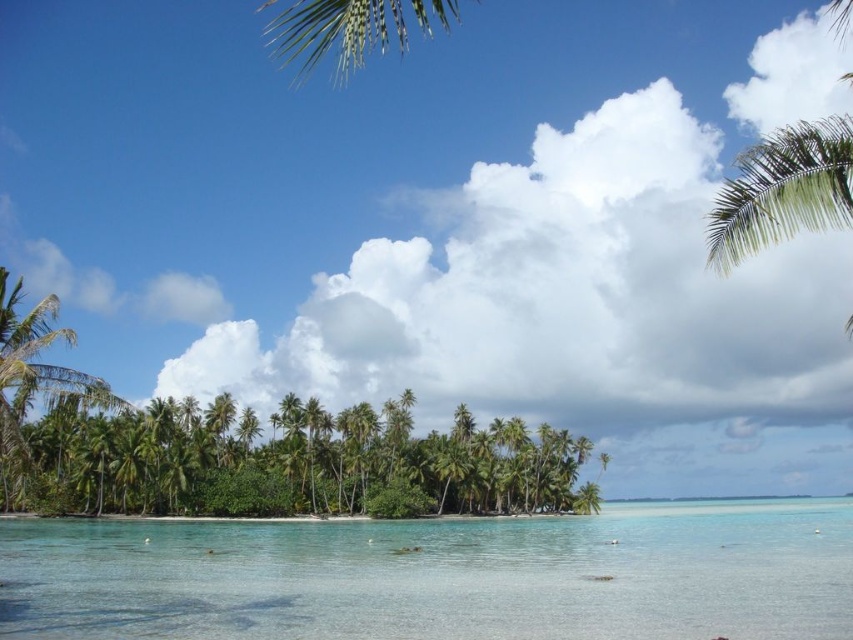
Between point (281, 584) and point (808, 132), which one is positioned in front?

Point (808, 132) is more forward.

Based on the photo, can you confirm if clear water at center is positioned below green leafy palm tree at upper right?

Yes, clear water at center is below green leafy palm tree at upper right.

Where is `clear water at center`? clear water at center is located at coordinates (438, 577).